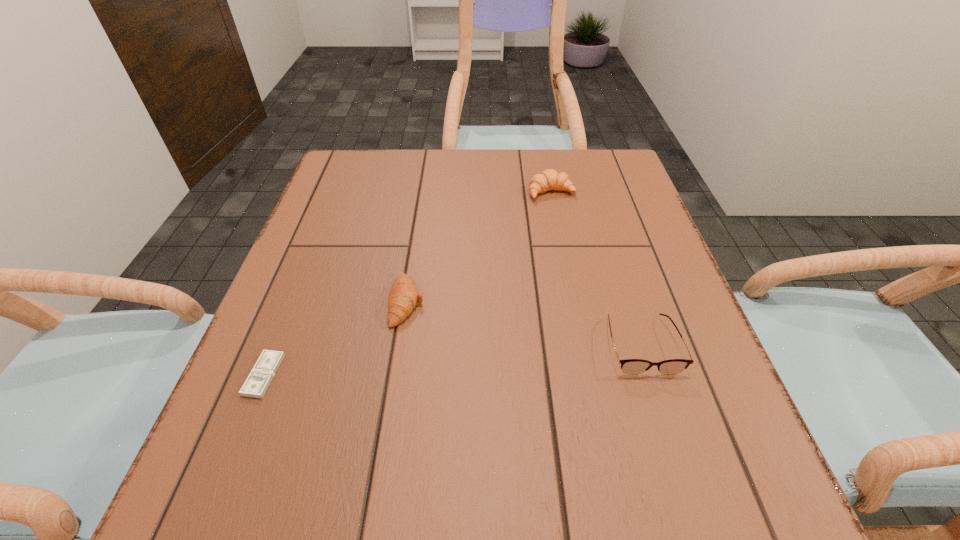
What are the coordinates of `free space located on the right of the money` in the screenshot? It's located at (471, 375).

Identify the location of object that is at the far edge. The height and width of the screenshot is (540, 960). (549, 179).

At what (x,y) coordinates should I click in order to perform the action: click on object present at the left edge. Please return your answer as a coordinate pair (x, y). The width and height of the screenshot is (960, 540). Looking at the image, I should click on (259, 379).

I want to click on crescent roll at the right edge, so click(x=549, y=179).

I want to click on spectacles that is at the right edge, so click(629, 366).

Image resolution: width=960 pixels, height=540 pixels. Find the location of `object located in the far right corner section of the desktop`. object located in the far right corner section of the desktop is located at coordinates (549, 179).

Find the location of a particular element. The height and width of the screenshot is (540, 960). vacant space at the far edge of the desktop is located at coordinates (519, 187).

In the image, there is a desktop. In order to click on vacant space at the left edge in this screenshot , I will do `click(355, 248)`.

Where is `vacant position at the right edge of the desktop`? This screenshot has height=540, width=960. vacant position at the right edge of the desktop is located at coordinates (648, 276).

Identify the location of vacant space at the far left corner of the desktop. The width and height of the screenshot is (960, 540). (356, 181).